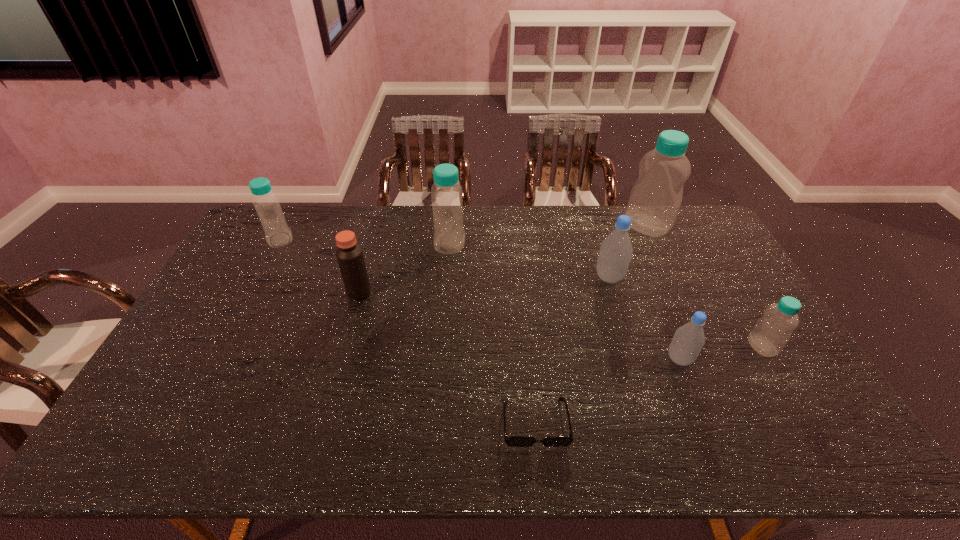
Find the location of a particular element. This screenshot has width=960, height=540. free spot located on the front of the vinegar is located at coordinates (329, 397).

This screenshot has height=540, width=960. In order to click on vacant region located on the left of the rightmost bottle in this screenshot , I will do `click(672, 346)`.

Image resolution: width=960 pixels, height=540 pixels. In order to click on free space located on the front of the smaller gray bottle in this screenshot , I will do `click(716, 449)`.

Where is `object at the near edge`? The width and height of the screenshot is (960, 540). object at the near edge is located at coordinates (512, 441).

Where is `object that is positioned at the left edge`? This screenshot has width=960, height=540. object that is positioned at the left edge is located at coordinates (277, 233).

The height and width of the screenshot is (540, 960). I want to click on object that is at the far left corner, so click(x=277, y=233).

Identify the location of object present at the far right corner. This screenshot has width=960, height=540. (655, 199).

What are the coordinates of `vacant space at the far edge of the desktop` in the screenshot? It's located at (500, 242).

You are a GUI agent. You are given a task and a screenshot of the screen. Output one action in this format:
    pyautogui.click(x=<x>, y=<y>)
    Task: Click on the vacant space at the left edge of the desktop
    The height and width of the screenshot is (540, 960).
    Given the screenshot: What is the action you would take?
    pyautogui.click(x=249, y=249)

Locate an element on the screen. free space at the right edge is located at coordinates (747, 348).